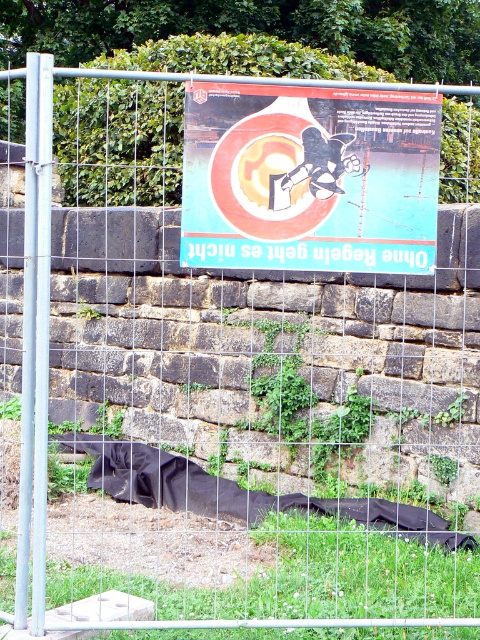
Can you confirm if teal paper poster at center is bigger than black fabric blanket at lower left?

No.

Who is higher up, teal paper poster at center or black fabric blanket at lower left?

Positioned higher is teal paper poster at center.

At what (x,y) coordinates should I click in order to perform the action: click on teal paper poster at center. Please return your answer as a coordinate pair (x, y). Looking at the image, I should click on (309, 179).

Where is `teal paper poster at center`? This screenshot has height=640, width=480. teal paper poster at center is located at coordinates (309, 179).